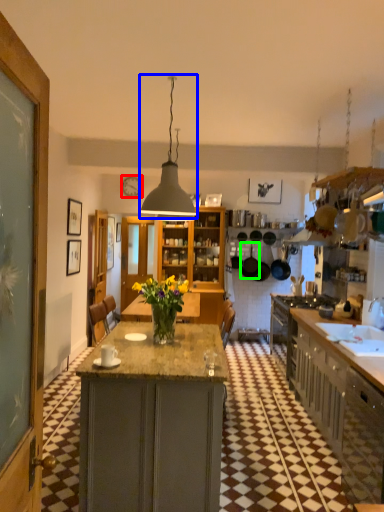
Question: Considering the real-world distances, which object is farthest from clock (highlighted by a red box)? light fixture (highlighted by a blue box) or kitchen appliance (highlighted by a green box)?

Choices:
 (A) light fixture
 (B) kitchen appliance

Answer: (A)